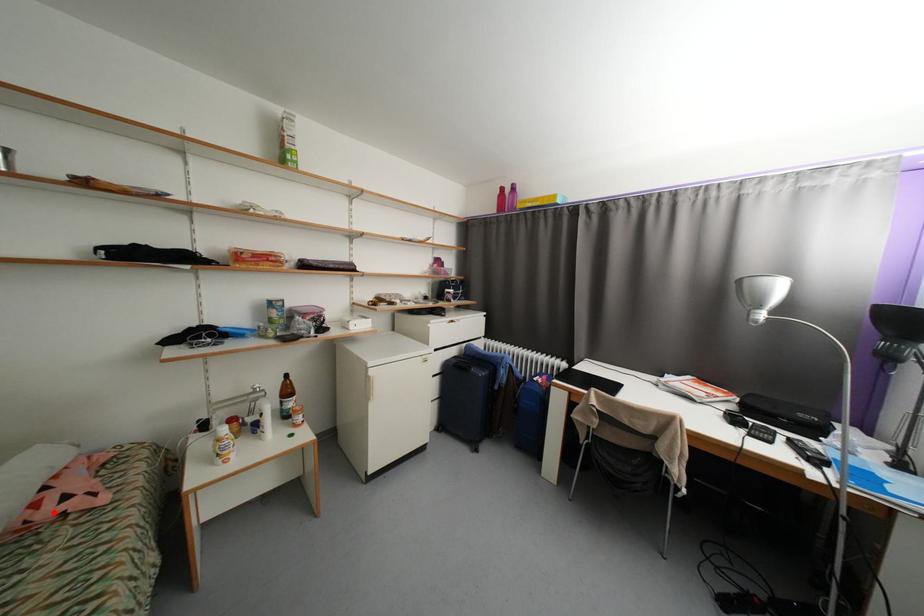
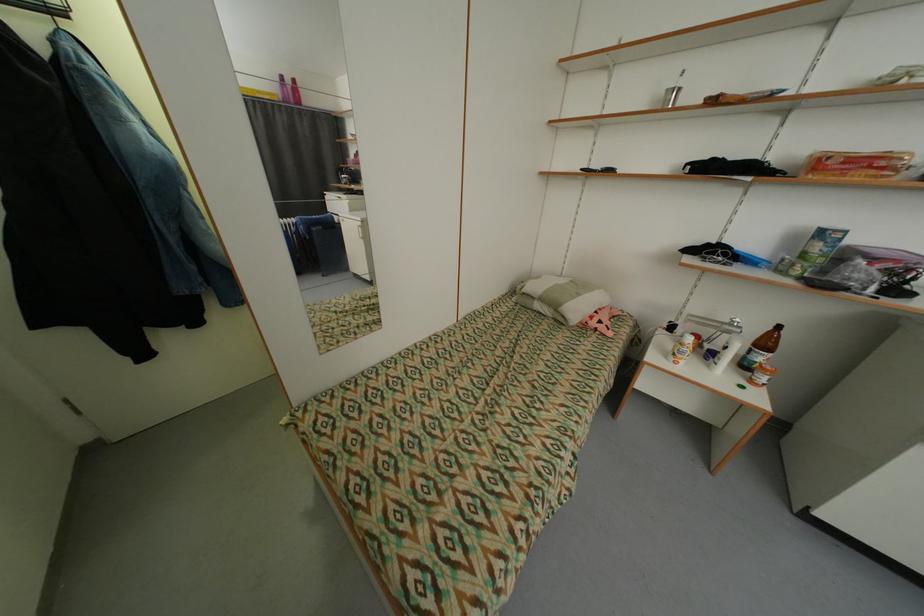
In the second image, find the point that corresponds to the highlighted location in the first image.

(600, 323)